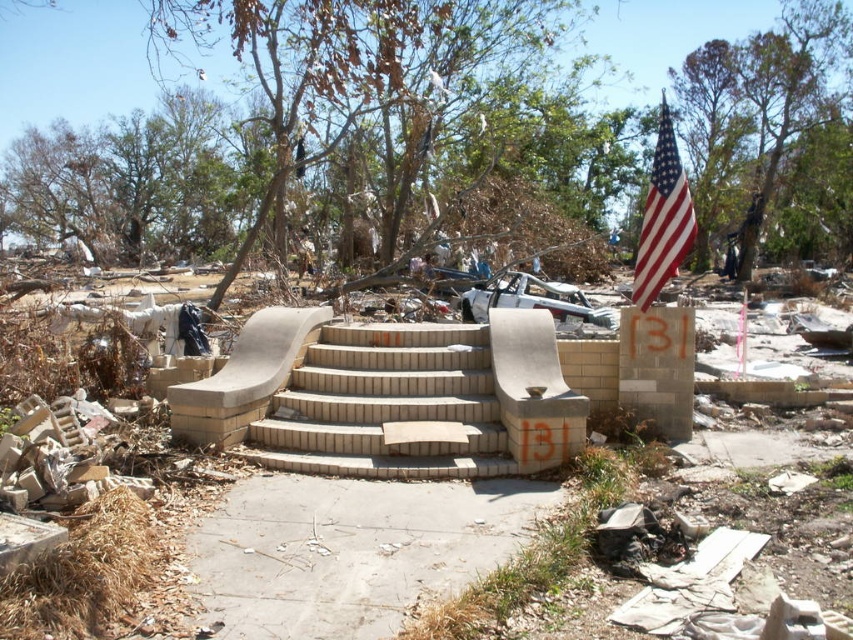
You are a rescue worker assessing the scene. You need to reach the american flag at upper right to check for signals. From your current position at the gray concrete sidewalk at center, which direction should you move to get closer to the flag?

To reach the american flag at upper right from the gray concrete sidewalk at center, you should move away from the viewer since the gray concrete sidewalk at center is closer to the viewer than the american flag at upper right.

Consider the image. You are a rescue worker assessing the scene. You need to determine the relative size of the beige brick stairs at center and the american flag at upper right. Which object is smaller?

The beige brick stairs at center is smaller than the american flag at upper right according to the description.